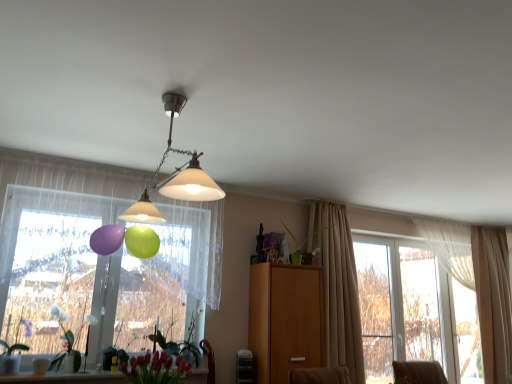
Question: Is clear glass window at right, which is counted as the first window frame, starting from the left, taller or shorter than green matte plant at center, the 4th plant positioned from the left?

Choices:
 (A) tall
 (B) short

Answer: (A)

Question: Considering the relative positions of clear glass window at right, arranged as the second window frame when viewed from the right, and green matte plant at center, the 4th plant positioned from the left, in the image provided, is clear glass window at right, arranged as the second window frame when viewed from the right, to the left or to the right of green matte plant at center, the 4th plant positioned from the left,?

Choices:
 (A) left
 (B) right

Answer: (B)

Question: Which of these objects is positioned farthest from the beige fabric curtain at right, which ranks as the second curtain in front-to-back order?

Choices:
 (A) beige fabric curtain at right, which is the second curtain in right-to-left order
 (B) clear glass window at right, arranged as the second window frame when viewed from the right
 (C) green matte plant at lower center, the second plant from the right
 (D) matte white lampshade at center
 (E) smooth glossy tulip at lower center

Answer: (D)

Question: Estimate the real-world distances between objects in this image. Which object is farther from the white matte plant at lower left, positioned as the third plant in right-to-left order?

Choices:
 (A) beige fabric curtain at right, which ranks as the 1th curtain in back-to-front order
 (B) green matte plant at center, acting as the first plant starting from the right
 (C) green matte plant at lower left, the 4th plant positioned from the right
 (D) beige fabric curtain at right, which is counted as the 1th curtain, starting from the left
 (E) wooden cabinet at center

Answer: (A)